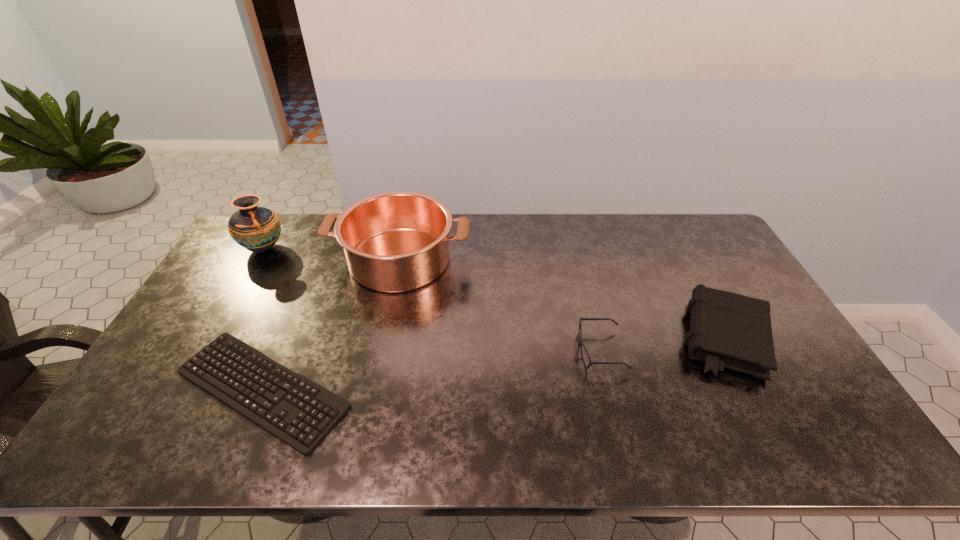
Locate an element on the screen. Image resolution: width=960 pixels, height=540 pixels. pottery is located at coordinates (257, 229).

Identify the location of saucepan. The height and width of the screenshot is (540, 960). (398, 241).

Identify the location of the rightmost object. This screenshot has width=960, height=540. (727, 330).

The width and height of the screenshot is (960, 540). Identify the location of the third shortest object. (727, 330).

In order to click on the fourth object from left to right in this screenshot , I will do `click(580, 342)`.

Locate an element on the screen. Image resolution: width=960 pixels, height=540 pixels. spectacles is located at coordinates (580, 342).

The image size is (960, 540). In order to click on computer keyboard in this screenshot , I will do `click(325, 401)`.

I want to click on free location located 0.320m on the front of the pottery, so click(x=213, y=335).

The image size is (960, 540). Identify the location of free spot located on the front of the saucepan. (380, 351).

Find the location of a particular element. The image size is (960, 540). free space located 0.170m on the front of the rightmost object is located at coordinates (783, 446).